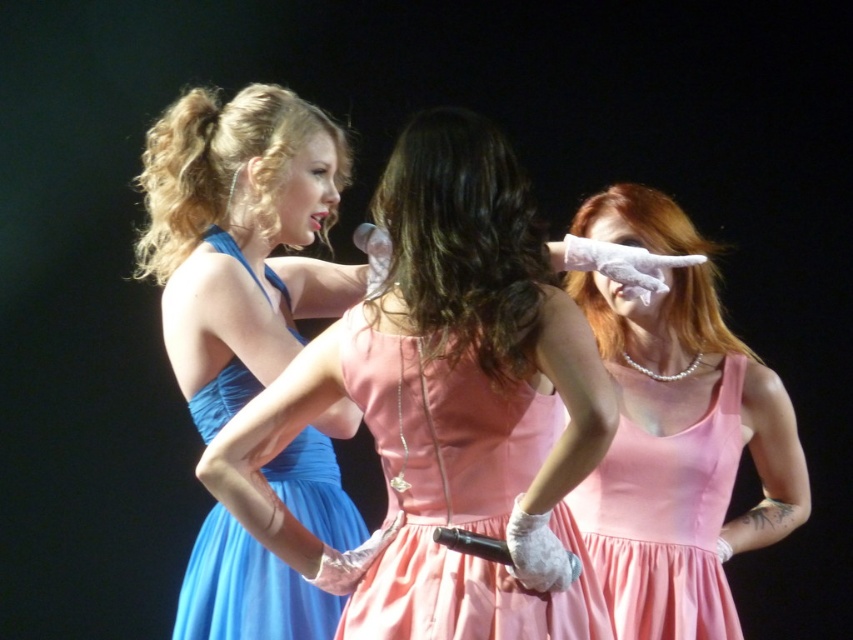
You are a photographer positioned at the back of the stage. You want to capture a photo where both the peach satin dress at center and the blue satin dress at left are clearly visible. Considering their heights, which dress might you need to adjust your camera angle to ensure it is fully in frame?

The peach satin dress at center is shorter than the blue satin dress at left, so you might need to lower your camera angle slightly to ensure the shorter peach satin dress at center is fully visible in the frame.

You are a photographer positioned at the back of the stage. You want to capture a clear photo of the blue satin dress at left without the matte blue dress at left blocking it. Is this possible given their current positions?

The matte blue dress at left is in front of the blue satin dress at left, so it is blocking the view. To capture a clear photo of the blue satin dress at left, you would need to move around or have the models adjust their positions to remove the obstruction.

You are a photographer positioned at the back of the stage. You need to take a photo of both the peach satin dress at center and the blue satin dress at left. Which dress should you focus on first to ensure both are in clear focus?

You should focus on the peach satin dress at center first since it is closer to the viewer than the blue satin dress at left. By focusing on the closer object, the depth of field may help keep both in focus.